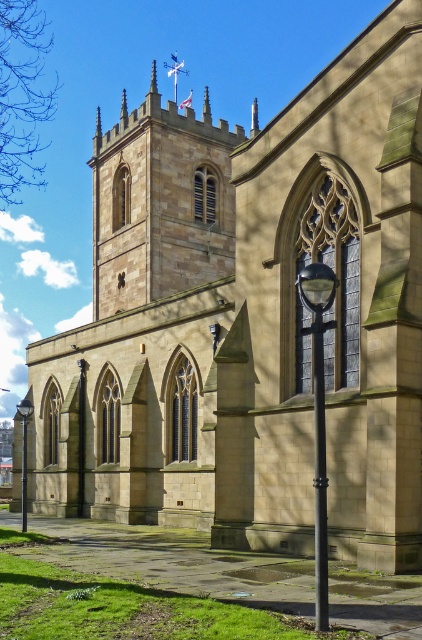
You are standing at the entrance of the historic stone church and want to locate the black metal pole at lower center. According to the image, what are the exact coordinates where you should look to find it?

The black metal pole at lower center is located at the coordinates point (319, 474).

You are standing in front of the historic stone church. Where is the brown stone tower at upper center located in the image? Please provide its coordinates in the format of a point with two decimal places.

The brown stone tower at upper center is located at point coordinates of [159,202].